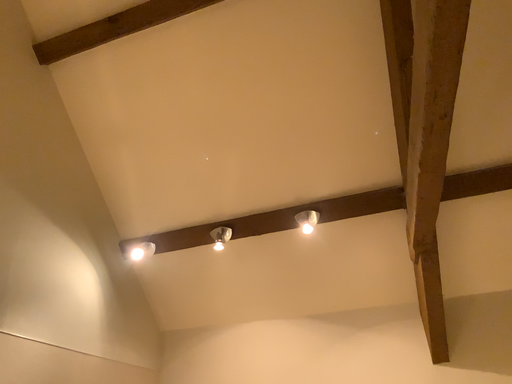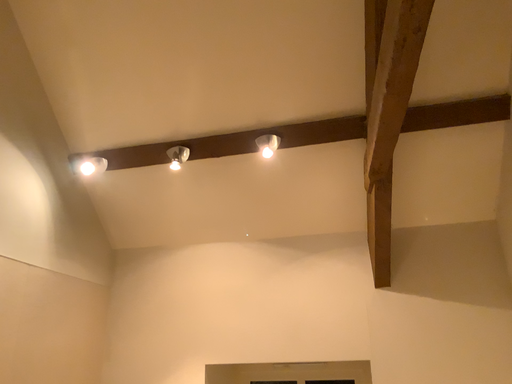
Question: Which way did the camera rotate in the video?

Choices:
 (A) rotated downward
 (B) rotated upward

Answer: (A)